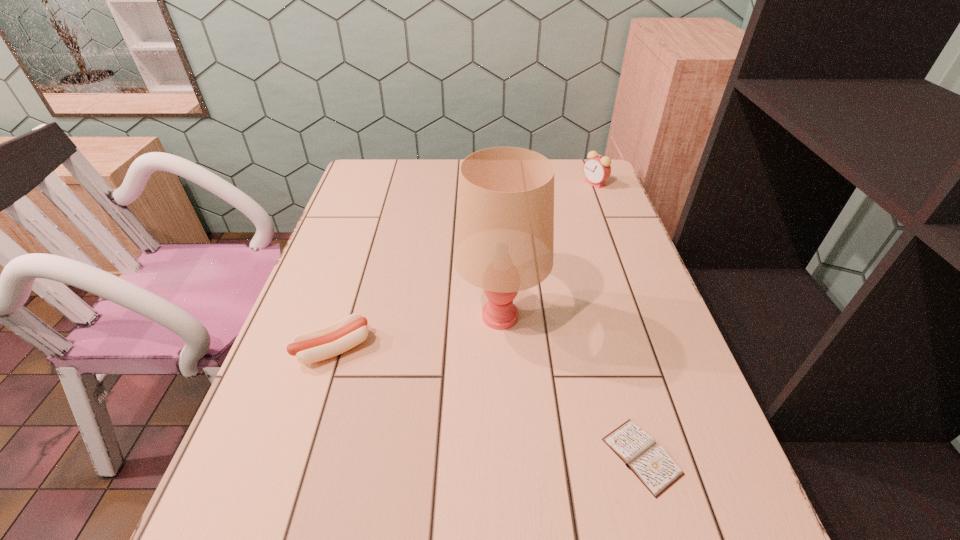
This screenshot has width=960, height=540. I want to click on the third object from right to left, so click(504, 238).

Identify the location of lampshade. (504, 238).

The image size is (960, 540). Find the location of `alarm clock`. alarm clock is located at coordinates (597, 169).

At what (x,y) coordinates should I click in order to perform the action: click on the second tallest object. Please return your answer as a coordinate pair (x, y). This screenshot has height=540, width=960. Looking at the image, I should click on (597, 169).

This screenshot has width=960, height=540. I want to click on the third tallest object, so click(337, 338).

What are the coordinates of `sausage` in the screenshot? It's located at coord(337,338).

The image size is (960, 540). Identify the location of the nearest object. coord(637,449).

You are a GUI agent. You are given a task and a screenshot of the screen. Output one action in this format:
    pyautogui.click(x=<x>, y=<y>)
    Task: Click on the diary
    The image size is (960, 540).
    Given the screenshot: What is the action you would take?
    pyautogui.click(x=637, y=449)

Image resolution: width=960 pixels, height=540 pixels. I want to click on free region located on the back of the tallest object, so click(x=495, y=211).

At what (x,y) coordinates should I click in order to perform the action: click on vacant position located 0.080m on the face of the alarm clock. Please return your answer as a coordinate pair (x, y). Looking at the image, I should click on (558, 184).